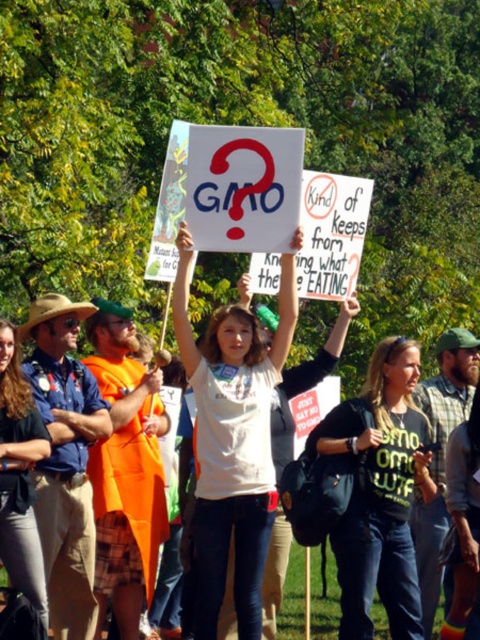
Between white cotton shirt at center and denim pants at lower left, which one has more height?

white cotton shirt at center

Is white cotton shirt at center below denim pants at lower left?

Incorrect, white cotton shirt at center is not positioned below denim pants at lower left.

Is point (259, 532) positioned before point (21, 524)?

That is False.

At what (x,y) coordinates should I click in order to perform the action: click on white cotton shirt at center. Please return your answer as a coordinate pair (x, y). The width and height of the screenshot is (480, 640). Looking at the image, I should click on (232, 442).

Can you confirm if white cotton shirt at center is smaller than green matte shirt at center?

Correct, white cotton shirt at center occupies less space than green matte shirt at center.

Find the location of `white cotton shirt at center`. white cotton shirt at center is located at coordinates (232, 442).

Find the location of `white cotton shirt at center`. white cotton shirt at center is located at coordinates (232, 442).

Locate an element on the screen. white cotton shirt at center is located at coordinates (232, 442).

Between green matte shirt at center and denim pants at lower left, which one appears on the right side from the viewer's perspective?

green matte shirt at center is more to the right.

Consider the image. Between green matte shirt at center and denim pants at lower left, which one has less height?

With less height is denim pants at lower left.

Between point (365, 444) and point (31, 554), which one is positioned behind?

Positioned behind is point (365, 444).

This screenshot has width=480, height=640. Identify the location of green matte shirt at center. (381, 492).